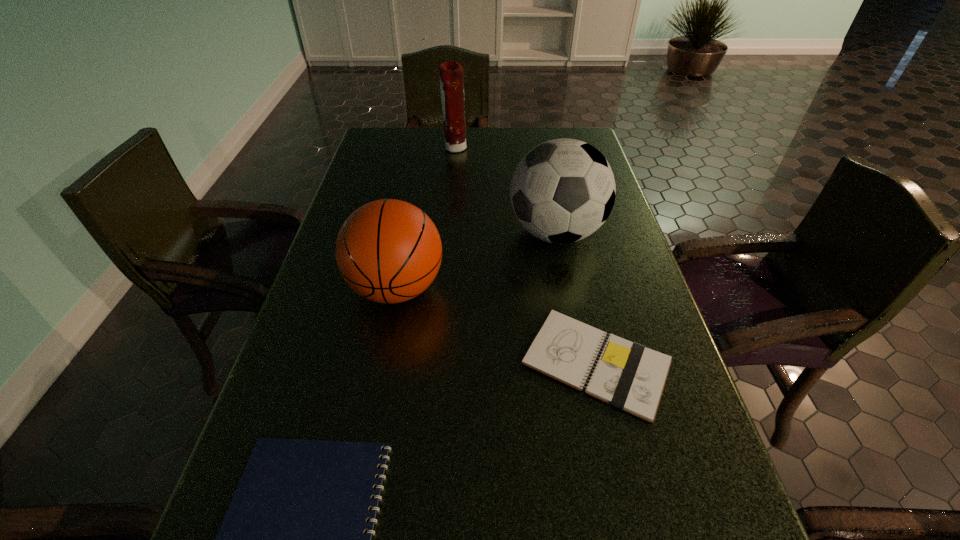
Where is `the farthest object`? This screenshot has height=540, width=960. the farthest object is located at coordinates (451, 73).

This screenshot has width=960, height=540. Identify the location of soccer ball. pos(563,190).

Find the location of a particular element. basketball is located at coordinates (389, 251).

This screenshot has height=540, width=960. I want to click on the taller notepad, so click(627, 375).

Find the location of a particular element. This screenshot has height=540, width=960. the right notepad is located at coordinates (627, 375).

At what (x,y) coordinates should I click in order to perform the action: click on free space located 0.100m on the front of the condiment. Please return your answer as a coordinate pair (x, y). The height and width of the screenshot is (540, 960). Looking at the image, I should click on (453, 173).

Locate an element on the screen. The width and height of the screenshot is (960, 540). vacant space located 0.100m on the main logo of the soccer ball is located at coordinates (469, 233).

Locate an element on the screen. vacant position located 0.270m on the main logo of the soccer ball is located at coordinates coord(405,233).

The image size is (960, 540). I want to click on vacant region located 0.240m on the main logo of the soccer ball, so click(417, 233).

Where is `vacant area located on the front of the basketball`? vacant area located on the front of the basketball is located at coordinates click(364, 462).